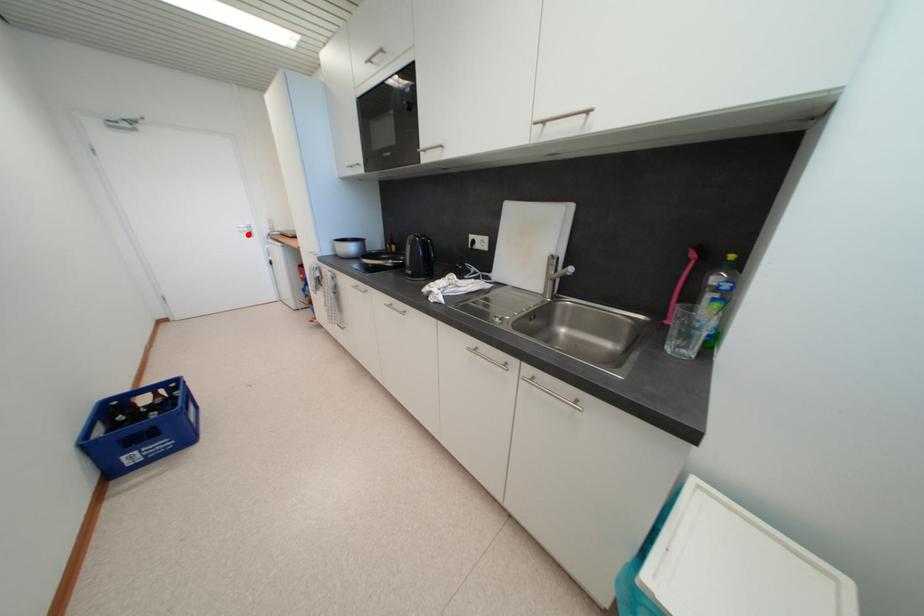
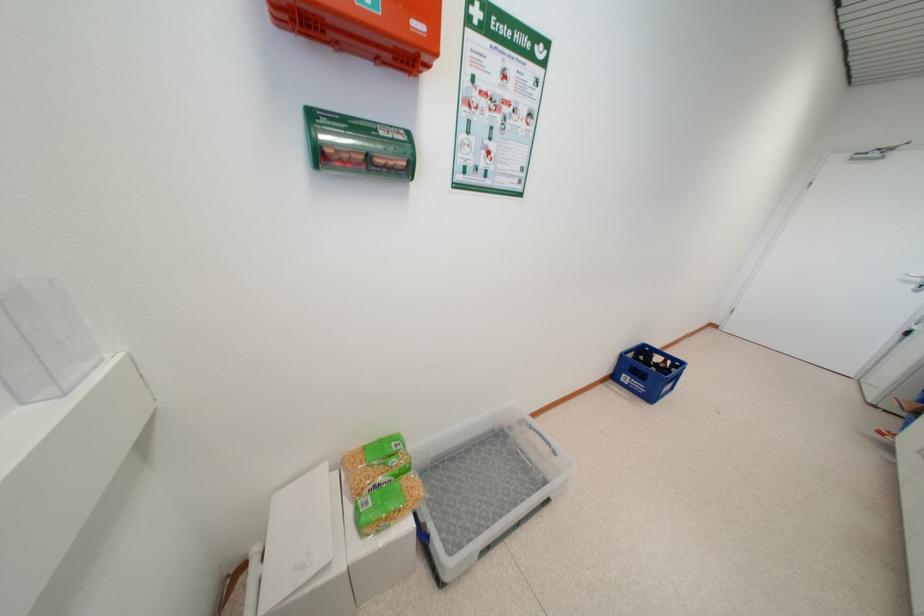
Locate, in the second image, the point that corresponds to the highlighted location in the first image.

(912, 284)